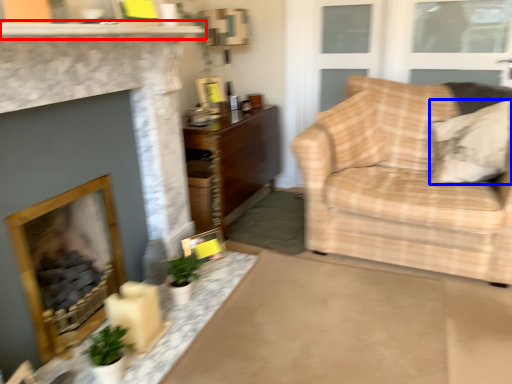
Question: Which object appears farthest to the camera in this image, mantle (highlighted by a red box) or pillow (highlighted by a blue box)?

Choices:
 (A) mantle
 (B) pillow

Answer: (B)